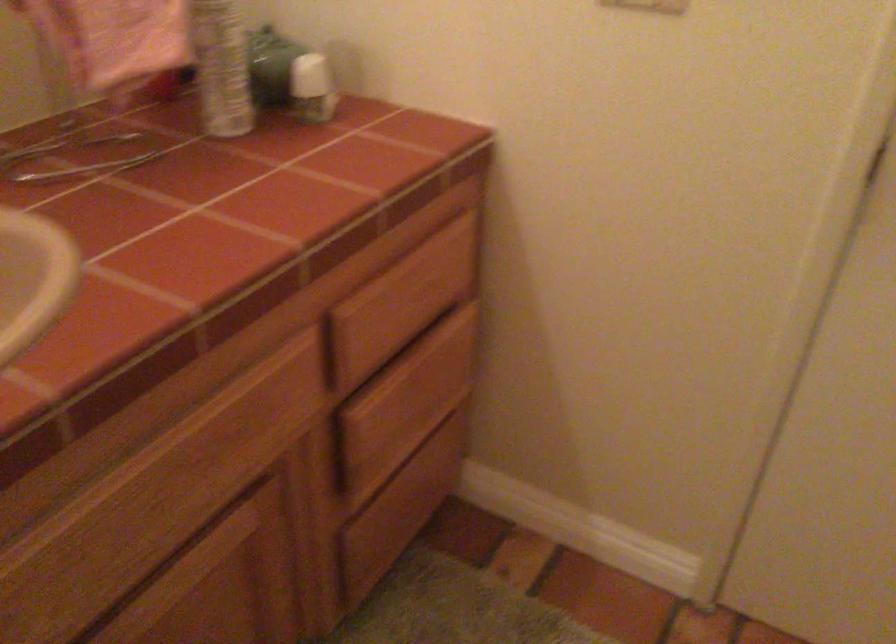
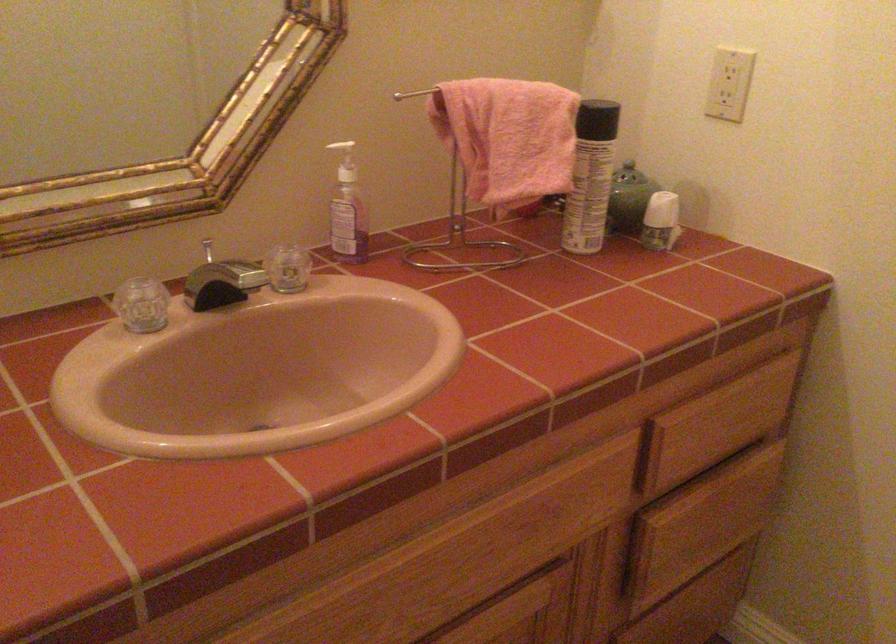
Locate, in the second image, the point that corresponds to point 407,408 in the first image.

(701, 524)